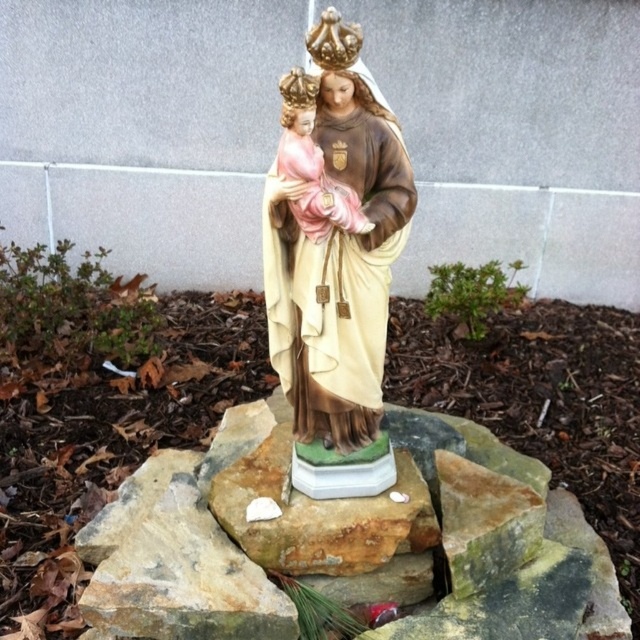
Question: Considering the real-world distances, which object is farthest from the green stone at center?

Choices:
 (A) matte porcelain statue at center
 (B) matte porcelain doll at center

Answer: (B)

Question: Does green stone at center have a smaller size compared to matte porcelain doll at center?

Choices:
 (A) no
 (B) yes

Answer: (A)

Question: Estimate the real-world distances between objects in this image. Which object is farther from the matte porcelain doll at center?

Choices:
 (A) matte porcelain statue at center
 (B) green stone at center

Answer: (B)

Question: Observing the image, what is the correct spatial positioning of green stone at center in reference to matte porcelain doll at center?

Choices:
 (A) below
 (B) above

Answer: (A)

Question: Does green stone at center lie behind matte porcelain doll at center?

Choices:
 (A) yes
 (B) no

Answer: (A)

Question: Which of the following is the closest to the observer?

Choices:
 (A) matte porcelain statue at center
 (B) matte porcelain doll at center

Answer: (B)